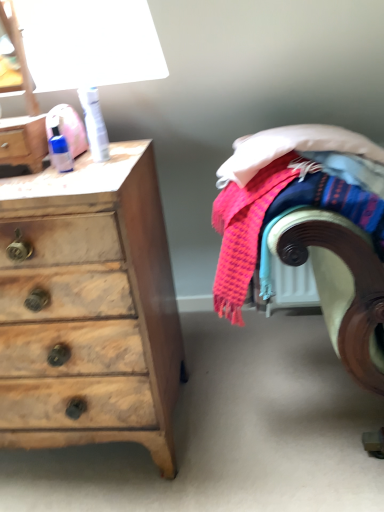
Question: From a real-world perspective, is wooden chest of drawers at left over blue plastic bottle at upper left, marked as the 1th toiletry in a left-to-right arrangement?

Choices:
 (A) no
 (B) yes

Answer: (A)

Question: Considering the relative positions of wooden chest of drawers at left and blue plastic bottle at upper left, marked as the 1th toiletry in a left-to-right arrangement, in the image provided, is wooden chest of drawers at left to the left of blue plastic bottle at upper left, marked as the 1th toiletry in a left-to-right arrangement, from the viewer's perspective?

Choices:
 (A) yes
 (B) no

Answer: (A)

Question: Is wooden chest of drawers at left at the right side of blue plastic bottle at upper left, marked as the 1th toiletry in a left-to-right arrangement?

Choices:
 (A) yes
 (B) no

Answer: (B)

Question: From the image's perspective, is wooden chest of drawers at left below blue plastic bottle at upper left, marked as the 1th toiletry in a left-to-right arrangement?

Choices:
 (A) no
 (B) yes

Answer: (B)

Question: Can you confirm if wooden chest of drawers at left is bigger than blue plastic bottle at upper left, marked as the 1th toiletry in a left-to-right arrangement?

Choices:
 (A) yes
 (B) no

Answer: (A)

Question: Considering the relative sizes of wooden chest of drawers at left and blue plastic bottle at upper left, marked as the 1th toiletry in a left-to-right arrangement, in the image provided, is wooden chest of drawers at left shorter than blue plastic bottle at upper left, marked as the 1th toiletry in a left-to-right arrangement,?

Choices:
 (A) no
 (B) yes

Answer: (A)

Question: Does matte plastic bottle at upper left have a smaller size compared to textured woolen blanket at right?

Choices:
 (A) no
 (B) yes

Answer: (B)

Question: Is matte plastic bottle at upper left positioned beyond the bounds of textured woolen blanket at right?

Choices:
 (A) yes
 (B) no

Answer: (A)

Question: From a real-world perspective, is matte plastic bottle at upper left on textured woolen blanket at right?

Choices:
 (A) no
 (B) yes

Answer: (B)

Question: Considering the relative positions of matte plastic bottle at upper left and textured woolen blanket at right in the image provided, is matte plastic bottle at upper left to the left of textured woolen blanket at right from the viewer's perspective?

Choices:
 (A) yes
 (B) no

Answer: (A)

Question: Is matte plastic bottle at upper left at the right side of textured woolen blanket at right?

Choices:
 (A) no
 (B) yes

Answer: (A)

Question: Does matte plastic bottle at upper left have a larger size compared to textured woolen blanket at right?

Choices:
 (A) no
 (B) yes

Answer: (A)

Question: Can we say blue plastic bottle at upper left, marked as the 1th toiletry in a left-to-right arrangement, lies outside white plastic can at upper left, arranged as the second toiletry when viewed from the left?

Choices:
 (A) no
 (B) yes

Answer: (B)